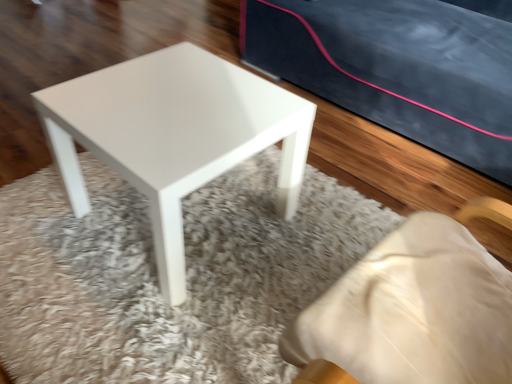
Locate an element on the screen. The height and width of the screenshot is (384, 512). vacant space that is to the left of white glossy stool at center is located at coordinates (47, 217).